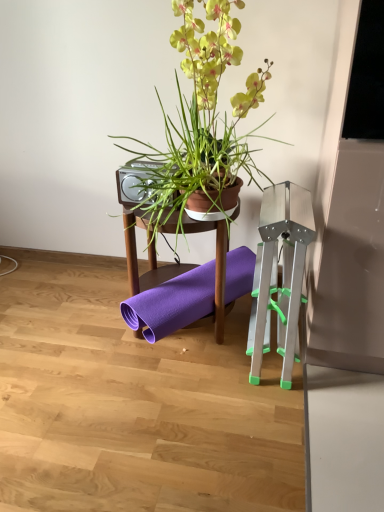
Question: From a real-world perspective, is metallic silver easel at right located beneath purple rubber yoga mat at center?

Choices:
 (A) no
 (B) yes

Answer: (A)

Question: Can you confirm if metallic silver easel at right is wider than purple rubber yoga mat at center?

Choices:
 (A) no
 (B) yes

Answer: (B)

Question: From the image's perspective, is metallic silver easel at right under purple rubber yoga mat at center?

Choices:
 (A) no
 (B) yes

Answer: (B)

Question: Is metallic silver easel at right shorter than purple rubber yoga mat at center?

Choices:
 (A) yes
 (B) no

Answer: (B)

Question: From the image's perspective, is metallic silver easel at right above purple rubber yoga mat at center?

Choices:
 (A) yes
 (B) no

Answer: (B)

Question: Considering the positions of metallic silver easel at right and purple rubber yoga mat at center in the image, is metallic silver easel at right taller or shorter than purple rubber yoga mat at center?

Choices:
 (A) tall
 (B) short

Answer: (A)

Question: From a real-world perspective, is metallic silver easel at right above or below purple rubber yoga mat at center?

Choices:
 (A) above
 (B) below

Answer: (A)

Question: Does point (291, 276) appear closer or farther from the camera than point (175, 270)?

Choices:
 (A) closer
 (B) farther

Answer: (A)

Question: In the image, is metallic silver easel at right positioned in front of or behind purple rubber yoga mat at center?

Choices:
 (A) behind
 (B) front

Answer: (B)

Question: Is point (223, 331) positioned closer to the camera than point (178, 190)?

Choices:
 (A) farther
 (B) closer

Answer: (A)

Question: Is purple rubber yoga mat at center inside the boundaries of silver metallic speaker at upper center, or outside?

Choices:
 (A) outside
 (B) inside

Answer: (A)

Question: Looking at their shapes, would you say purple rubber yoga mat at center is wider or thinner than silver metallic speaker at upper center?

Choices:
 (A) thin
 (B) wide

Answer: (B)

Question: From a real-world perspective, is purple rubber yoga mat at center above or below silver metallic speaker at upper center?

Choices:
 (A) below
 (B) above

Answer: (A)

Question: Based on their sizes in the image, would you say silver metallic speaker at upper center is bigger or smaller than green matte plant pot at upper center?

Choices:
 (A) small
 (B) big

Answer: (A)

Question: From the image's perspective, is silver metallic speaker at upper center positioned above or below green matte plant pot at upper center?

Choices:
 (A) below
 (B) above

Answer: (A)